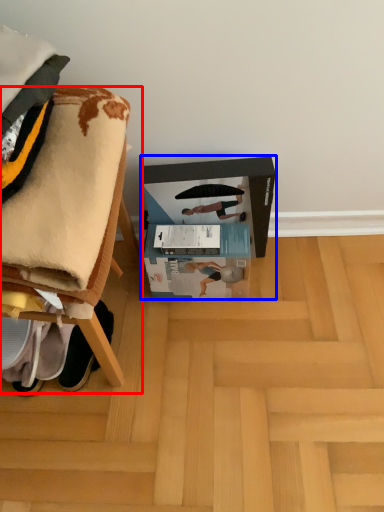
Question: Which object appears closest to the camera in this image, furniture (highlighted by a red box) or cardboard box (highlighted by a blue box)?

Choices:
 (A) furniture
 (B) cardboard box

Answer: (A)